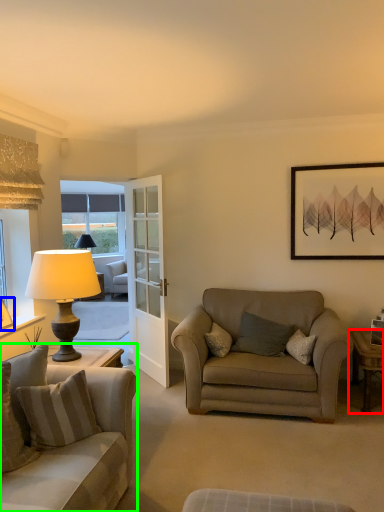
Question: Which is farther away from desk (highlighted by a red box)? picture frame (highlighted by a blue box) or studio couch (highlighted by a green box)?

Choices:
 (A) picture frame
 (B) studio couch

Answer: (A)